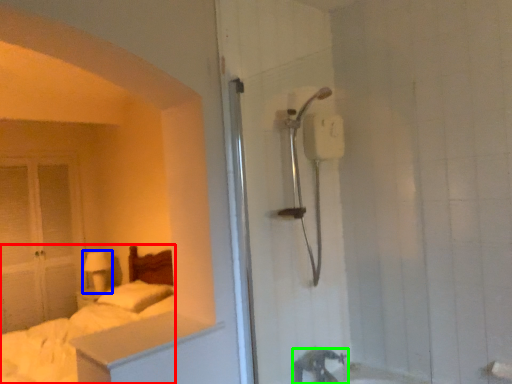
Question: Which object is positioned farthest from bed (highlighted by a red box)? Select from lamp (highlighted by a blue box) and tap (highlighted by a green box).

Choices:
 (A) lamp
 (B) tap

Answer: (B)